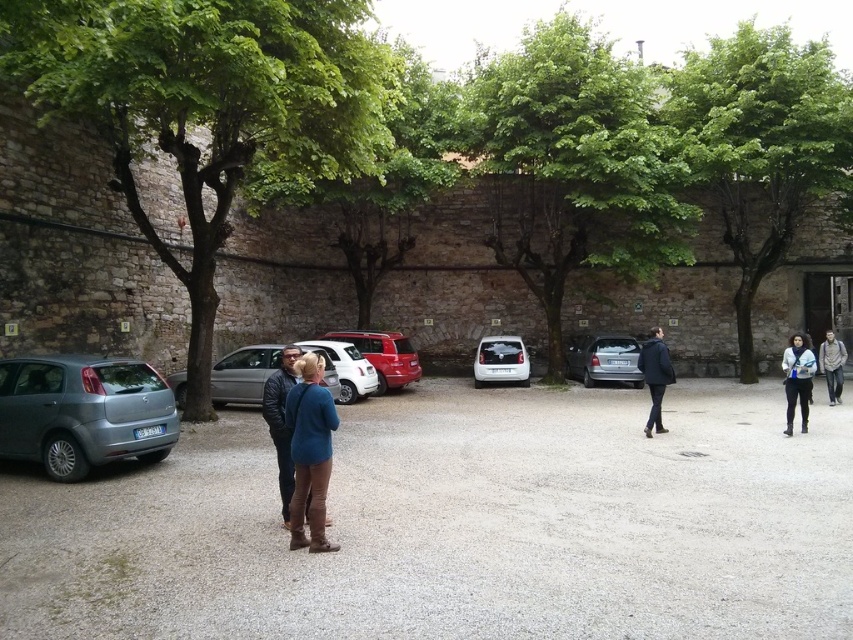
You are standing at the point marked by coordinates point [761,145] in the parking area. Looking around, you see a green leafy tree at upper right. Is the tree to your left or right side?

The green leafy tree at upper right is located at point [761,145], which is the same as your current position. Therefore, you are standing directly under the tree.

You are standing at the entrance of the parking area and want to park your car. You see a shiny red car at center and a white matte car at center. Which car is closer to the left side of the parking area?

The shiny red car at center is closer to the left side of the parking area because it is positioned to the left of the white matte car at center.

You are a photographer trying to capture a shot of the white matte hatchback at center without the green leafy tree at upper right blocking the view. Based on their sizes, can you position yourself in a way that the tree doesn

The green leafy tree at upper right is wider than the white matte hatchback at center. Since the tree is wider, positioning yourself to the side of the hatchback might allow you to frame the shot so the tree doesn